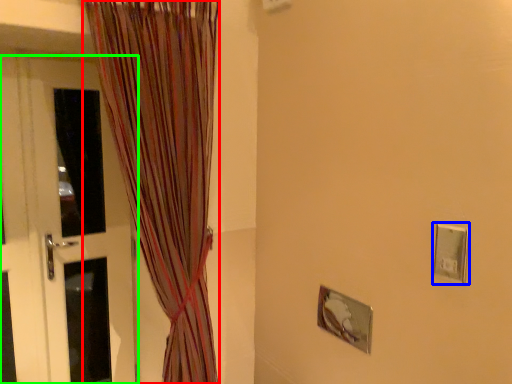
Question: Which object is the farthest from curtain (highlighted by a red box)? Choose among these: electric outlet (highlighted by a blue box) or door (highlighted by a green box).

Choices:
 (A) electric outlet
 (B) door

Answer: (A)